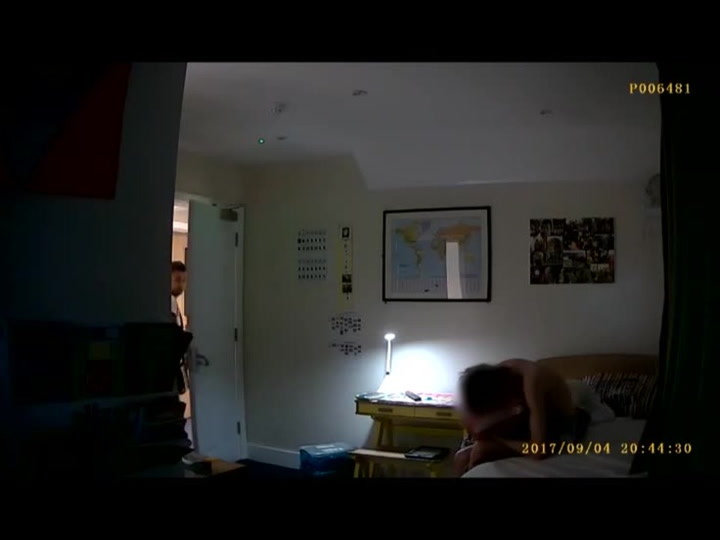
Where is `desk`? desk is located at coordinates tap(418, 410).